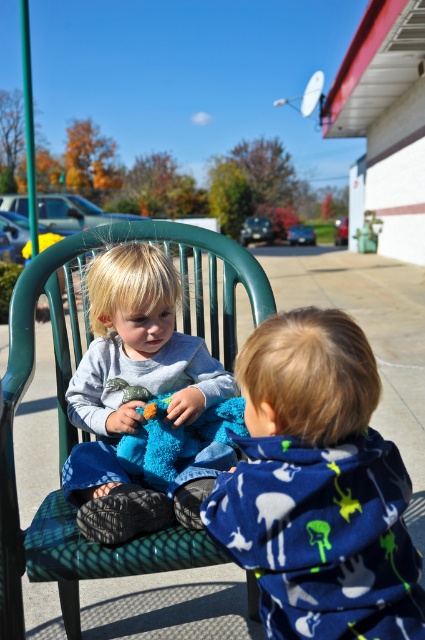
Question: Which of the following is the farthest from the observer?

Choices:
 (A) (139, 596)
 (B) (317, 620)

Answer: (A)

Question: Is green fabric rocking chair at center smaller than soft gray sweater at center?

Choices:
 (A) yes
 (B) no

Answer: (B)

Question: Which of the following is the farthest from the observer?

Choices:
 (A) (181, 577)
 (B) (206, 477)

Answer: (A)

Question: Is green fabric rocking chair at center positioned behind soft gray sweater at center?

Choices:
 (A) yes
 (B) no

Answer: (A)

Question: Does blue fleece hoodie at center come behind soft gray sweater at center?

Choices:
 (A) no
 (B) yes

Answer: (A)

Question: Estimate the real-world distances between objects in this image. Which object is farther from the soft gray sweater at center?

Choices:
 (A) blue fleece hoodie at center
 (B) green fabric rocking chair at center

Answer: (B)